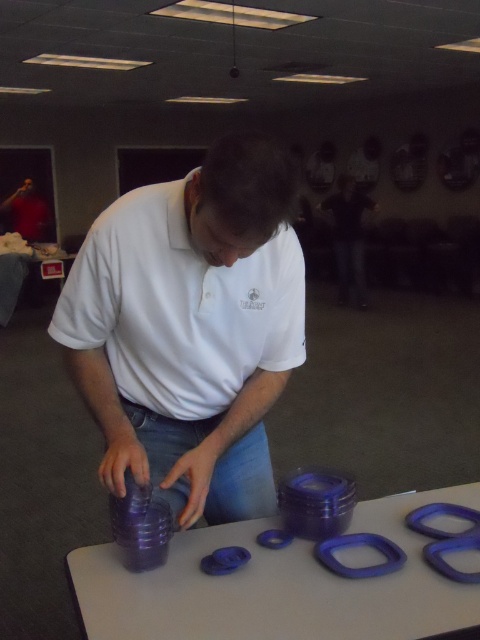
Which is above, white matte shirt at center or purple plastic rings at center?

white matte shirt at center

Between white matte shirt at center and purple plastic rings at center, which one has more height?

With more height is white matte shirt at center.

Find the location of a particular element. This screenshot has width=480, height=640. white matte shirt at center is located at coordinates (191, 328).

Find the location of `white matte shirt at center`. white matte shirt at center is located at coordinates (191, 328).

Can you confirm if purple plastic rings at center is smaller than matte white shirt at center?

Indeed, purple plastic rings at center has a smaller size compared to matte white shirt at center.

Between purple plastic rings at center and matte white shirt at center, which one appears on the left side from the viewer's perspective?

purple plastic rings at center

Describe the element at coordinates (276, 586) in the screenshot. I see `purple plastic rings at center` at that location.

This screenshot has width=480, height=640. Identify the location of purple plastic rings at center. (276, 586).

Can you confirm if white matte shirt at center is thinner than matte white shirt at center?

Yes.

Find the location of a particular element. white matte shirt at center is located at coordinates (191, 328).

Find the location of a particular element. The image size is (480, 640). white matte shirt at center is located at coordinates (x=191, y=328).